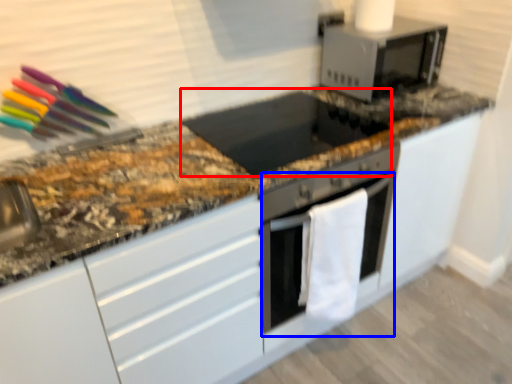
Question: Which object appears closest to the camera in this image, appliance (highlighted by a red box) or oven (highlighted by a blue box)?

Choices:
 (A) appliance
 (B) oven

Answer: (A)